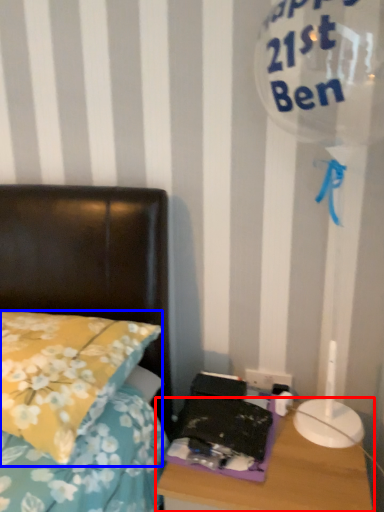
Question: Which of the following is the closest to the observer, nightstand (highlighted by a red box) or pillow (highlighted by a blue box)?

Choices:
 (A) nightstand
 (B) pillow

Answer: (B)